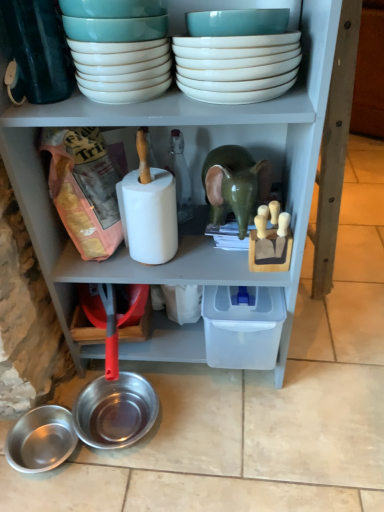
Where is `vacant area that is in front of shiny metallic bowl at lower left, which ranks as the second bowl in bottom-to-top order`? vacant area that is in front of shiny metallic bowl at lower left, which ranks as the second bowl in bottom-to-top order is located at coordinates (125, 487).